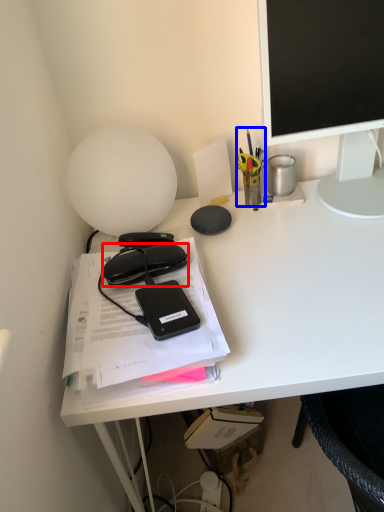
Question: Which of the following is the farthest to the observer, stationery (highlighted by a red box) or stationery (highlighted by a blue box)?

Choices:
 (A) stationery
 (B) stationery

Answer: (B)